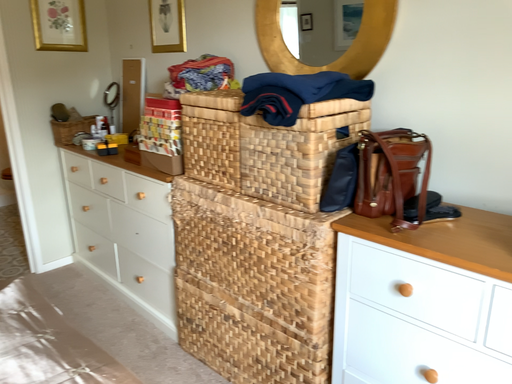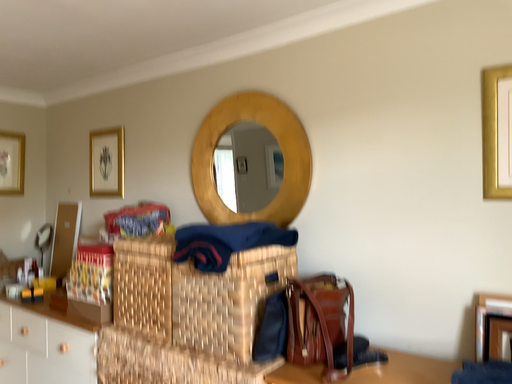
Question: How did the camera likely rotate when shooting the video?

Choices:
 (A) rotated upward
 (B) rotated downward

Answer: (A)